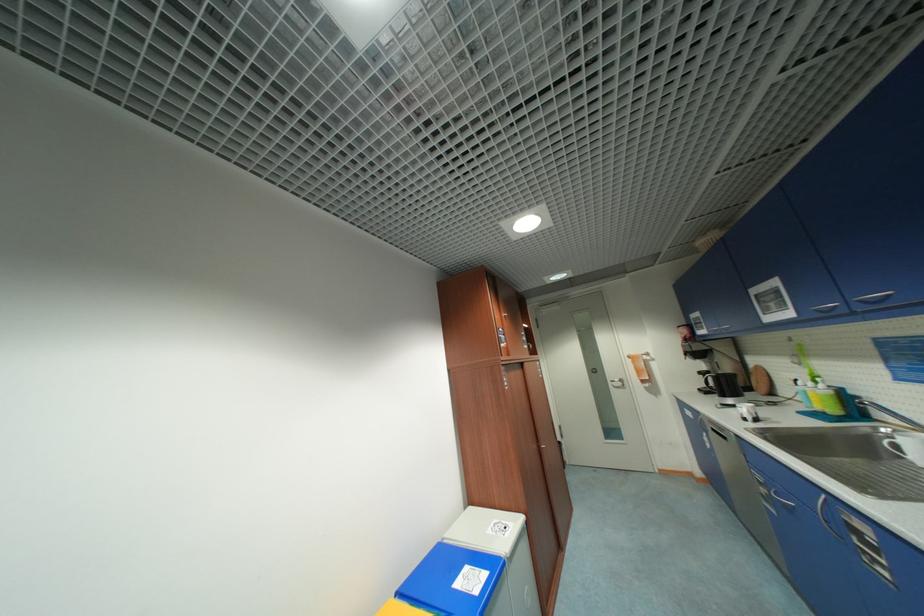
Where would you lift the grey bin lid? Please return your answer as a coordinate pair (x, y).

(485, 530)